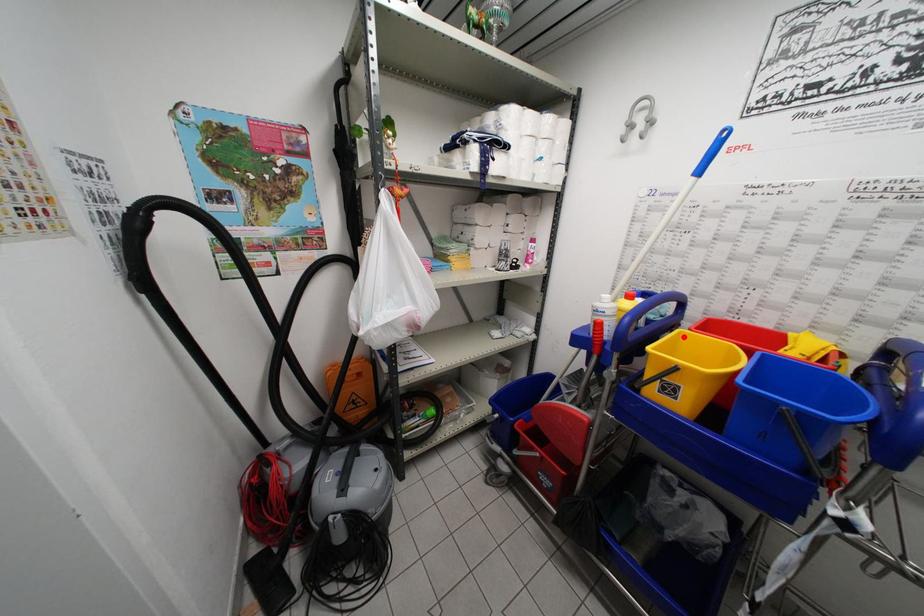
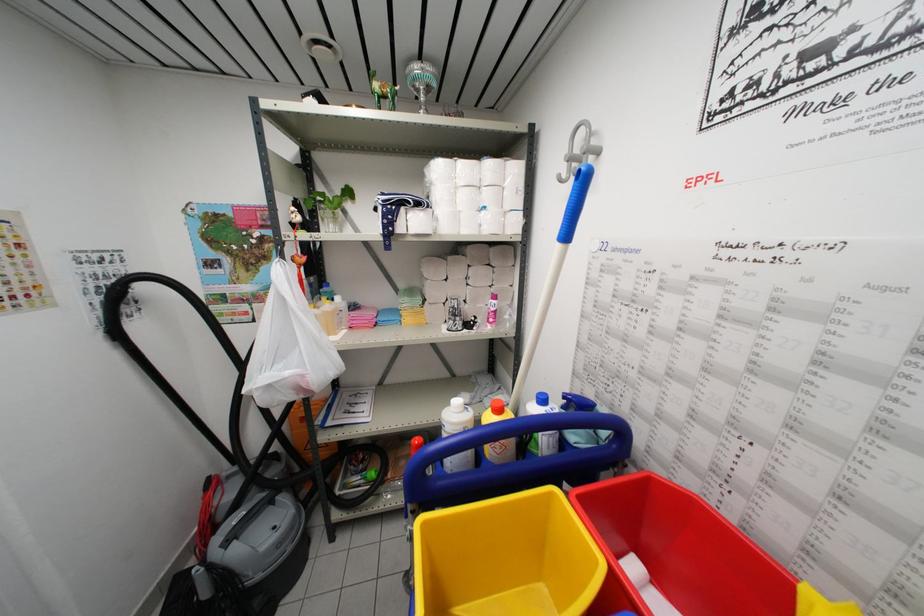
Locate, in the second image, the point that corresponds to the highlighted location in the first image.

(554, 498)